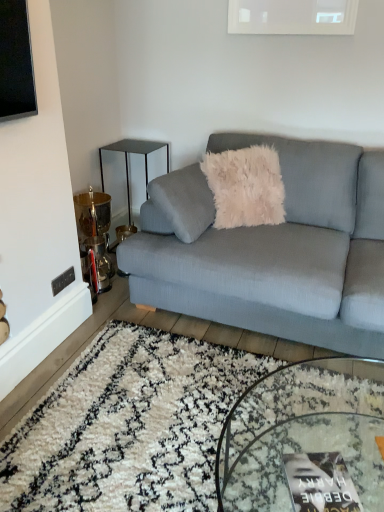
This screenshot has width=384, height=512. Identify the location of blank space situated above matte black magazine at lower center (from a real-world perspective). (323, 483).